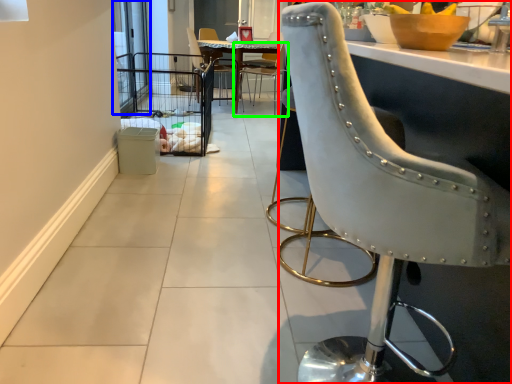
Question: Estimate the real-world distances between objects in this image. Which object is farther from chair (highlighted by a red box), screen door (highlighted by a blue box) or chair (highlighted by a green box)?

Choices:
 (A) screen door
 (B) chair

Answer: (B)